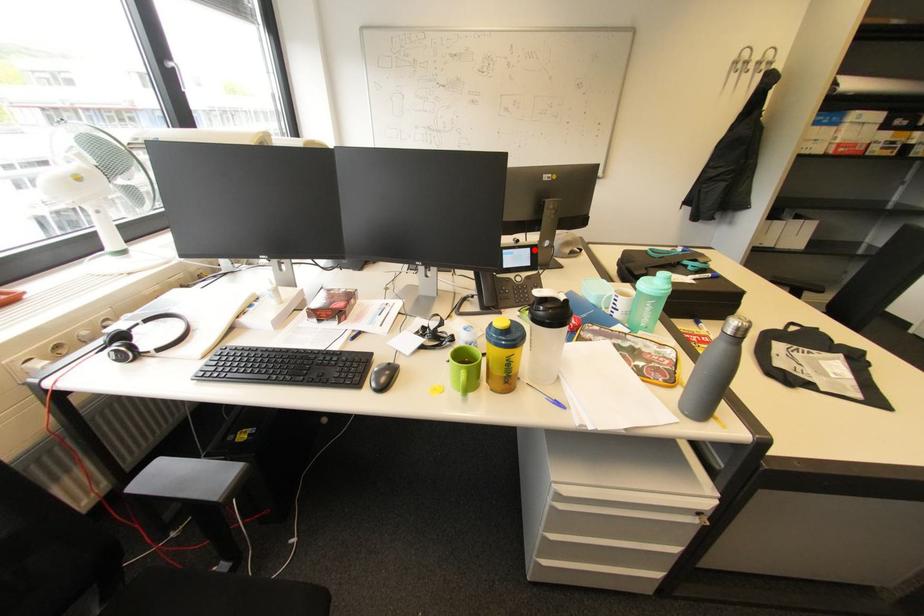
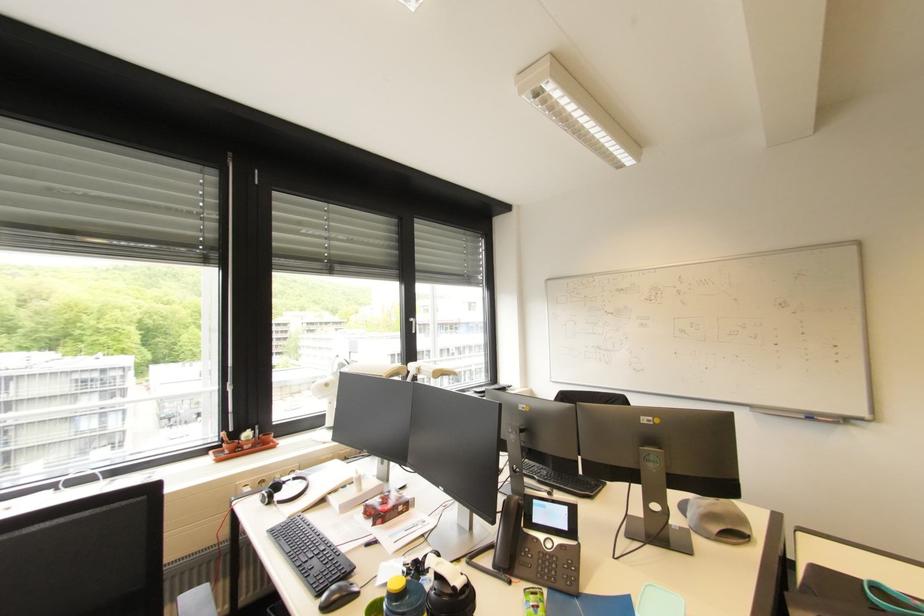
Find the pixel in the second image that matches the highlighted location in the first image.

(572, 509)